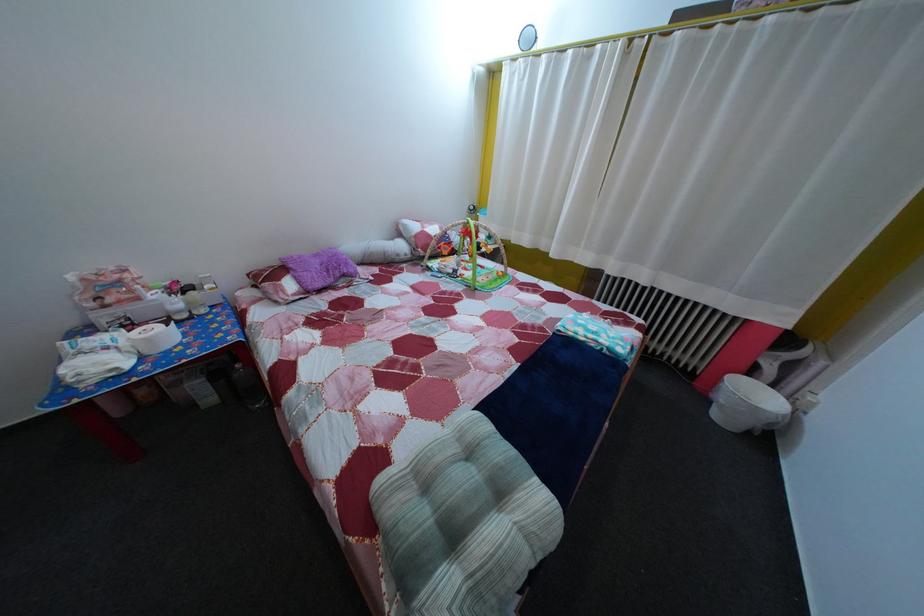
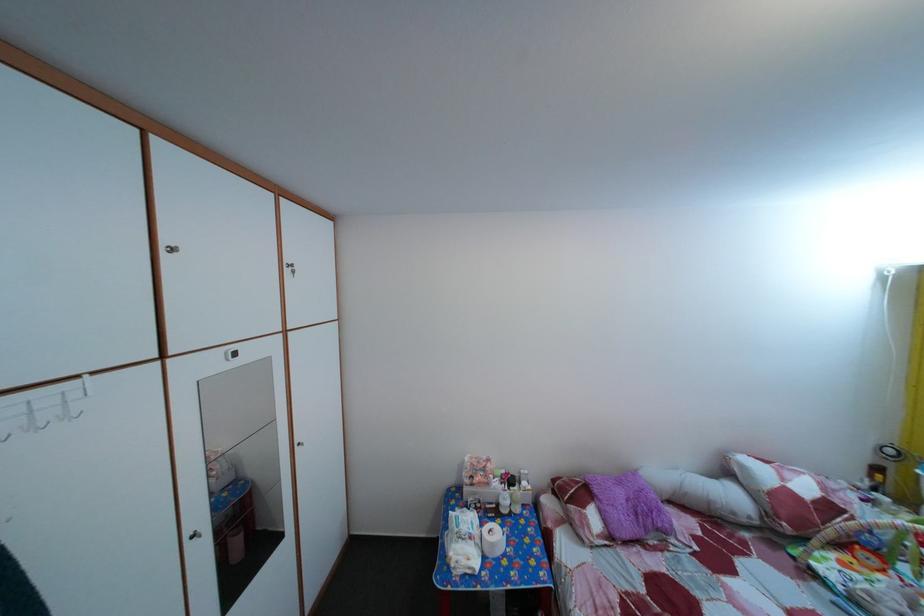
Find the pixel in the second image that matches (157,347) in the first image.

(502, 553)